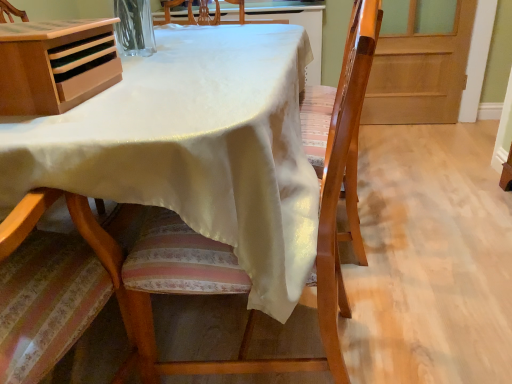
Question: Is light brown wood desk at upper left beside wooden chair at center?

Choices:
 (A) yes
 (B) no

Answer: (B)

Question: Is light brown wood desk at upper left closer to the viewer compared to wooden chair at center?

Choices:
 (A) yes
 (B) no

Answer: (B)

Question: Considering the relative sizes of light brown wood desk at upper left and wooden chair at center in the image provided, is light brown wood desk at upper left bigger than wooden chair at center?

Choices:
 (A) yes
 (B) no

Answer: (B)

Question: Considering the relative sizes of light brown wood desk at upper left and wooden chair at center in the image provided, is light brown wood desk at upper left wider than wooden chair at center?

Choices:
 (A) yes
 (B) no

Answer: (B)

Question: Considering the relative positions of light brown wood desk at upper left and wooden chair at center in the image provided, is light brown wood desk at upper left to the left of wooden chair at center from the viewer's perspective?

Choices:
 (A) no
 (B) yes

Answer: (B)

Question: Considering the positions of white satin tablecloth at center and light brown wood desk at upper left in the image, is white satin tablecloth at center wider or thinner than light brown wood desk at upper left?

Choices:
 (A) thin
 (B) wide

Answer: (B)

Question: Considering the relative positions of white satin tablecloth at center and light brown wood desk at upper left in the image provided, is white satin tablecloth at center to the left or to the right of light brown wood desk at upper left?

Choices:
 (A) left
 (B) right

Answer: (B)

Question: In the image, is white satin tablecloth at center positioned in front of or behind light brown wood desk at upper left?

Choices:
 (A) front
 (B) behind

Answer: (A)

Question: Is white satin tablecloth at center inside or outside of light brown wood desk at upper left?

Choices:
 (A) outside
 (B) inside

Answer: (A)

Question: Is white satin tablecloth at center taller or shorter than wooden screen door at right?

Choices:
 (A) short
 (B) tall

Answer: (A)

Question: From a real-world perspective, relative to wooden screen door at right, is white satin tablecloth at center vertically above or below?

Choices:
 (A) above
 (B) below

Answer: (B)

Question: Considering the positions of point (137, 175) and point (415, 8), is point (137, 175) closer or farther from the camera than point (415, 8)?

Choices:
 (A) farther
 (B) closer

Answer: (B)

Question: From the image's perspective, is white satin tablecloth at center located above or below wooden screen door at right?

Choices:
 (A) above
 (B) below

Answer: (B)

Question: Is wooden chair at center in front of or behind light brown wood desk at upper left in the image?

Choices:
 (A) behind
 (B) front

Answer: (B)

Question: In the image, is wooden chair at center on the left side or the right side of light brown wood desk at upper left?

Choices:
 (A) left
 (B) right

Answer: (B)